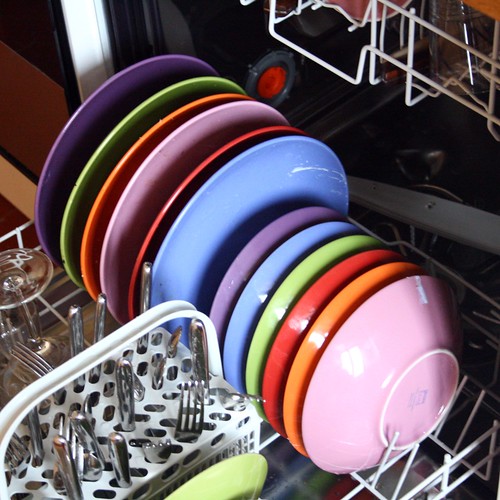
Locate an element on the screen. The image size is (500, 500). plates is located at coordinates (84, 131), (106, 147), (126, 164), (147, 178), (172, 198), (209, 210).